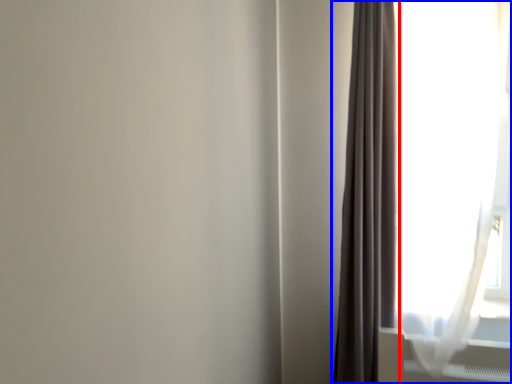
Question: Which object is closer to the camera taking this photo, curtain (highlighted by a red box) or curtain (highlighted by a blue box)?

Choices:
 (A) curtain
 (B) curtain

Answer: (B)